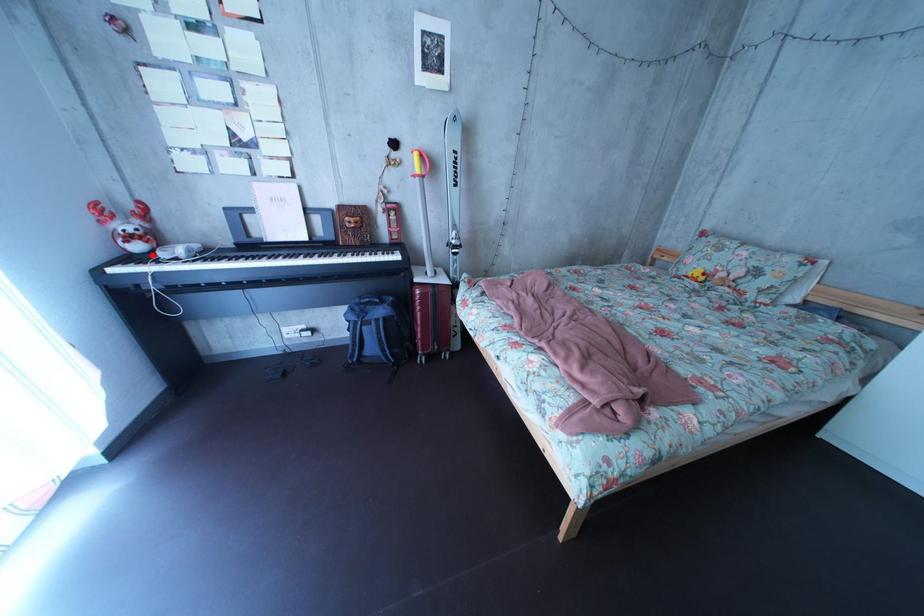
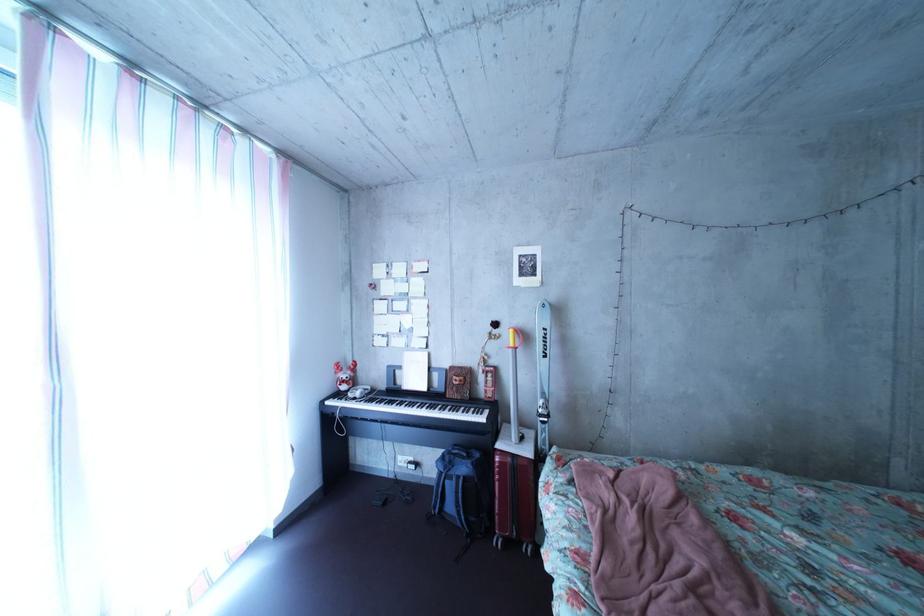
Question: I am providing you with two images of the same scene from different viewpoints. Given a red point in image1, look at the same physical point in image2. Is it:

Choices:
 (A) Closer to the viewpoint
 (B) Farther from the viewpoint

Answer: (B)